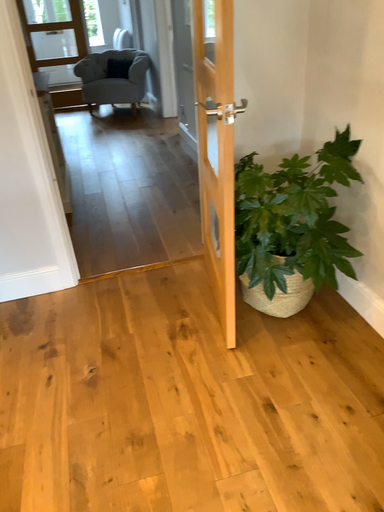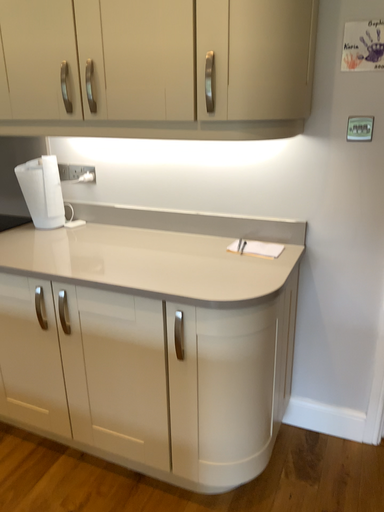
Question: How did the camera likely rotate when shooting the video?

Choices:
 (A) rotated left
 (B) rotated right

Answer: (A)